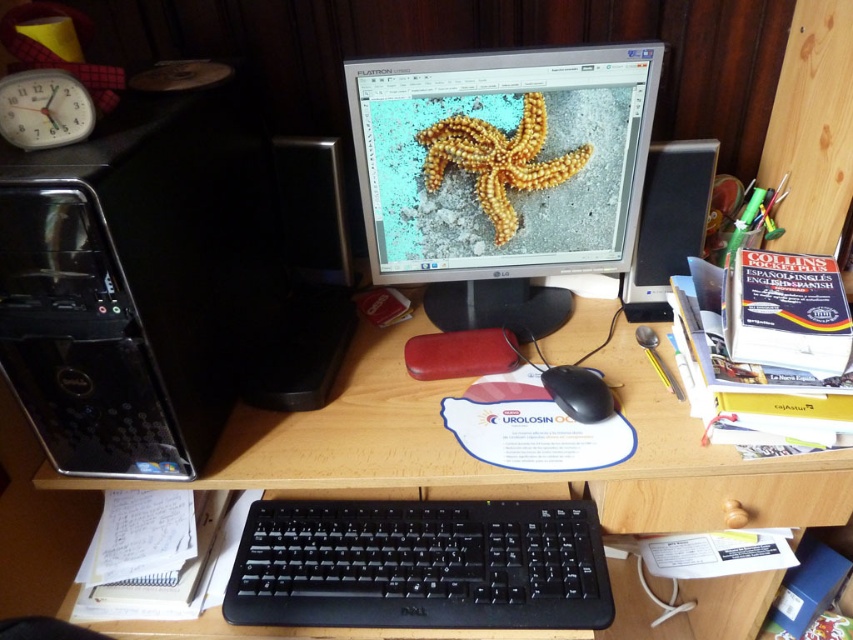
Question: Is black plastic computer tower at left thinner than black plastic speaker at right?

Choices:
 (A) no
 (B) yes

Answer: (A)

Question: Is black plastic keyboard at center further to camera compared to black plastic speaker at right?

Choices:
 (A) yes
 (B) no

Answer: (B)

Question: Which of these objects is positioned closest to the black plastic speaker at right?

Choices:
 (A) yellow matte starfish at center
 (B) black plastic computer tower at left

Answer: (A)

Question: Which point is closer to the camera?

Choices:
 (A) yellow matte starfish at center
 (B) matte black monitor at center

Answer: (B)

Question: Is wooden at lower center closer to camera compared to black plastic speaker at right?

Choices:
 (A) no
 (B) yes

Answer: (B)

Question: Which object is the farthest from the black plastic mouse at center?

Choices:
 (A) black plastic keyboard at center
 (B) black plastic computer tower at left
 (C) yellow matte starfish at center
 (D) black plastic speaker at right

Answer: (B)